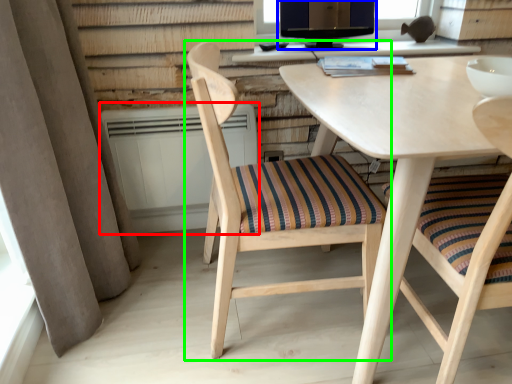
Question: Considering the real-world distances, which object is farthest from radiator (highlighted by a red box)? computer monitor (highlighted by a blue box) or chair (highlighted by a green box)?

Choices:
 (A) computer monitor
 (B) chair

Answer: (A)